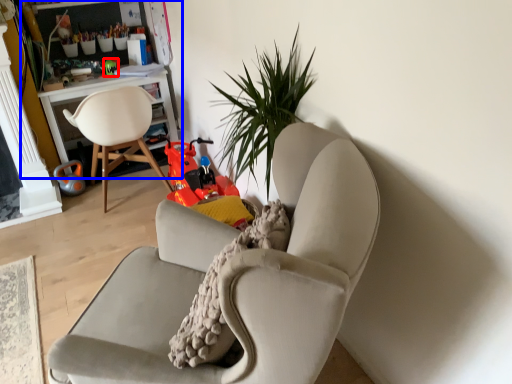
Question: Which object is closer to the camera taking this photo, toy (highlighted by a red box) or bookshelf (highlighted by a blue box)?

Choices:
 (A) toy
 (B) bookshelf

Answer: (B)